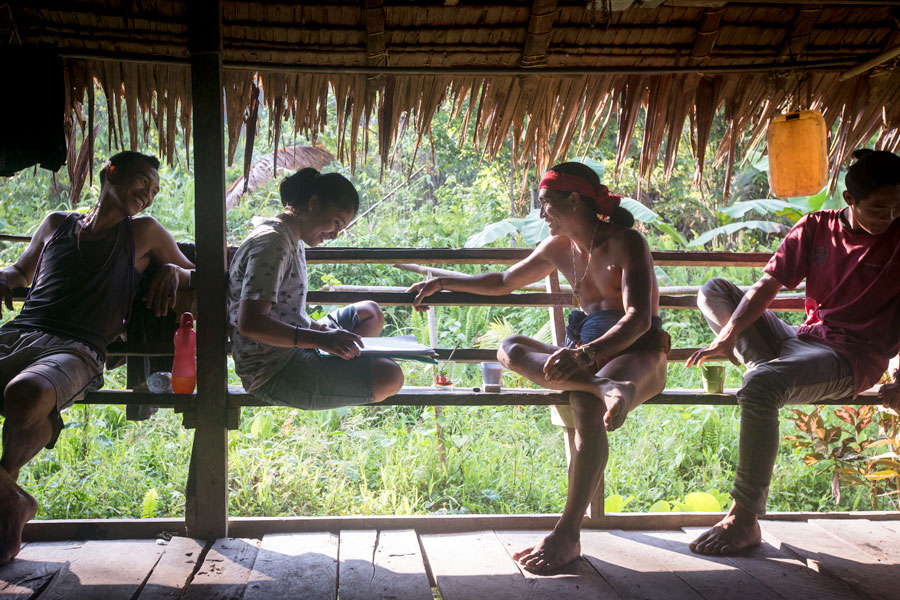
In order to click on floor in this screenshot , I will do `click(456, 566)`.